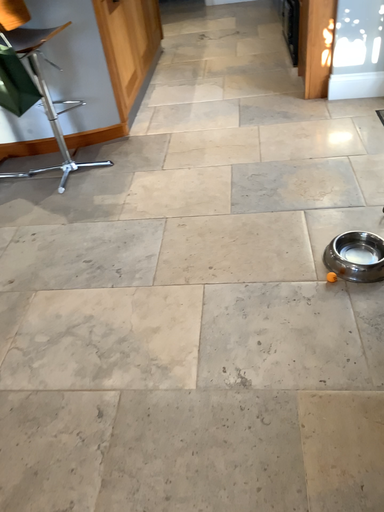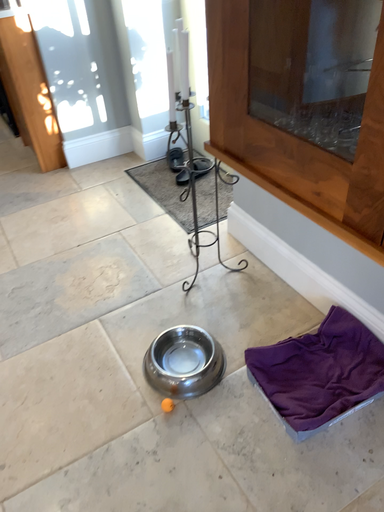
Question: How did the camera likely rotate when shooting the video?

Choices:
 (A) rotated downward
 (B) rotated upward

Answer: (B)